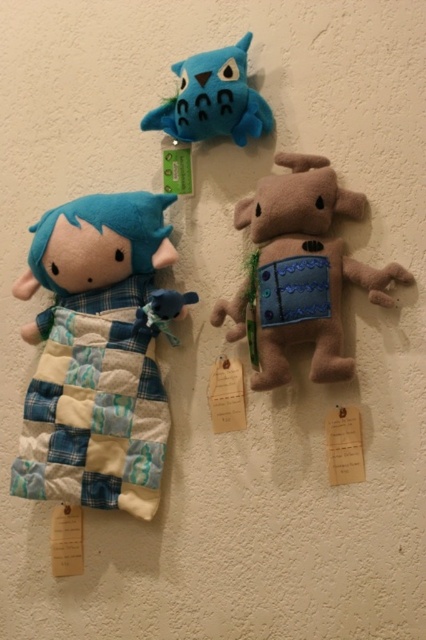
What do you see at coordinates (97, 355) in the screenshot?
I see `patchwork fabric doll at left` at bounding box center [97, 355].

Is patchwork fabric doll at left below matte blue plush owl at upper center?

Yes.

Who is more forward, (71, 400) or (232, 99)?

Point (232, 99)

Locate an element on the screen. patchwork fabric doll at left is located at coordinates (97, 355).

Based on the photo, is patchwork fabric doll at left smaller than brown plush dog at center?

No, patchwork fabric doll at left is not smaller than brown plush dog at center.

Is patchwork fabric doll at left wider than brown plush dog at center?

Indeed, patchwork fabric doll at left has a greater width compared to brown plush dog at center.

Between point (91, 227) and point (330, 352), which one is positioned in front?

Point (330, 352) is more forward.

Identify the location of patchwork fabric doll at left. Image resolution: width=426 pixels, height=640 pixels. [97, 355].

Looking at this image, is brown plush dog at center thinner than matte blue plush owl at upper center?

Incorrect, brown plush dog at center's width is not less than matte blue plush owl at upper center's.

Is brown plush dog at center to the left of matte blue plush owl at upper center from the viewer's perspective?

In fact, brown plush dog at center is to the right of matte blue plush owl at upper center.

Image resolution: width=426 pixels, height=640 pixels. Describe the element at coordinates (305, 268) in the screenshot. I see `brown plush dog at center` at that location.

Where is `brown plush dog at center`? The width and height of the screenshot is (426, 640). brown plush dog at center is located at coordinates (305, 268).